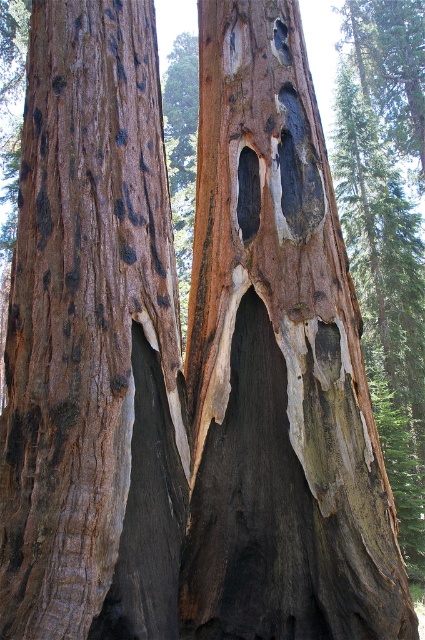
Looking at this image, you are standing in a forest and see two points marked on the ground. The first point is at coordinate point(20, 426) and the second is at point(319, 214). Which point is closer to you?

Point(20, 426) is in front of point(319, 214), so it is closer to you.

From the picture: You are a biologist studying tree cavities in the forest. You observe two holes in the tree trunks. Which hole is positioned to the right when comparing the black rough hole at center and the dark gray wood hole at upper center?

The black rough hole at center is to the right of the dark gray wood hole at upper center.